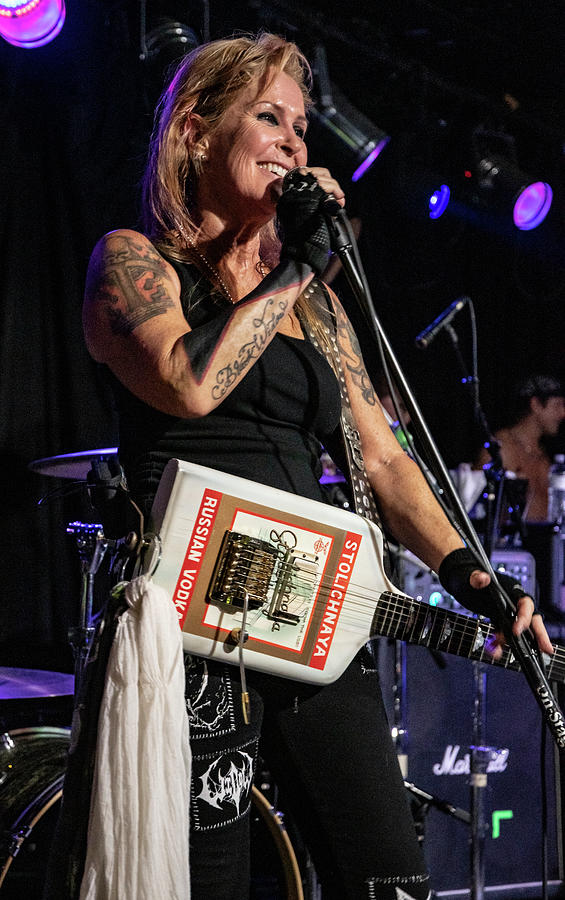
Find the location of a particular element. The height and width of the screenshot is (900, 565). purple lights is located at coordinates (534, 202), (368, 157), (31, 25).